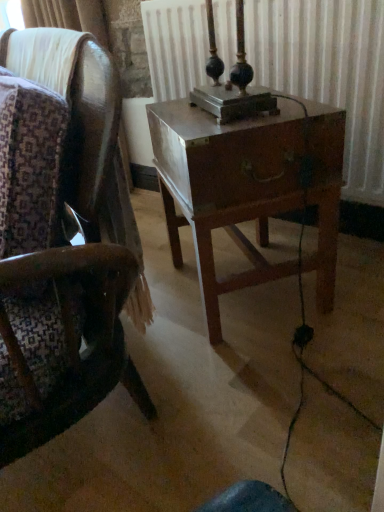
Question: Should I look upward or downward to see metallic radiator at center?

Choices:
 (A) down
 (B) up

Answer: (B)

Question: Does metallic radiator at center come in front of wooden chair at center?

Choices:
 (A) no
 (B) yes

Answer: (A)

Question: Are metallic radiator at center and wooden chair at center far apart?

Choices:
 (A) no
 (B) yes

Answer: (A)

Question: Is metallic radiator at center to the right of wooden chair at center from the viewer's perspective?

Choices:
 (A) no
 (B) yes

Answer: (B)

Question: Is metallic radiator at center surrounding wooden chair at center?

Choices:
 (A) no
 (B) yes

Answer: (A)

Question: Is metallic radiator at center taller than wooden chair at center?

Choices:
 (A) no
 (B) yes

Answer: (A)

Question: Is metallic radiator at center positioned with its back to wooden chair at center?

Choices:
 (A) no
 (B) yes

Answer: (A)

Question: From the image's perspective, would you say wooden chair at center is shown under wooden nightstand at center?

Choices:
 (A) yes
 (B) no

Answer: (B)

Question: Is wooden chair at center next to wooden nightstand at center and touching it?

Choices:
 (A) yes
 (B) no

Answer: (B)

Question: Are wooden chair at center and wooden nightstand at center far apart?

Choices:
 (A) yes
 (B) no

Answer: (B)

Question: Can you confirm if wooden chair at center is bigger than wooden nightstand at center?

Choices:
 (A) no
 (B) yes

Answer: (B)

Question: From the image's perspective, is wooden chair at center on wooden nightstand at center?

Choices:
 (A) yes
 (B) no

Answer: (A)

Question: Can you confirm if wooden chair at center is positioned to the right of wooden nightstand at center?

Choices:
 (A) yes
 (B) no

Answer: (B)

Question: Could metallic radiator at center be considered to be inside wooden nightstand at center?

Choices:
 (A) no
 (B) yes

Answer: (A)